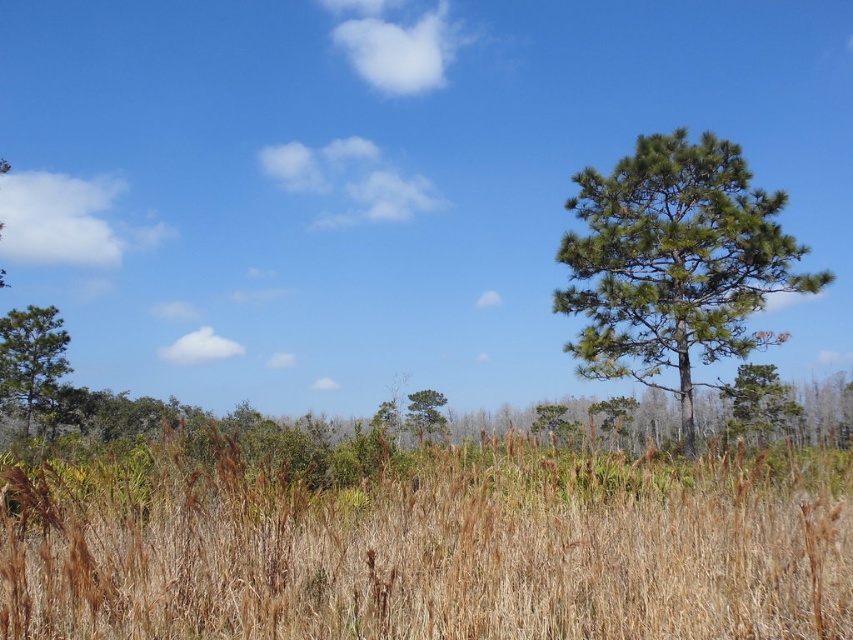
Question: Is green needle-like tree at right thinner than green textured pine tree at left?

Choices:
 (A) no
 (B) yes

Answer: (A)

Question: Which point is closer to the camera taking this photo?

Choices:
 (A) (410, 417)
 (B) (703, 356)
 (C) (44, 356)

Answer: (B)

Question: Can you confirm if green needle-like tree at right is positioned to the right of green matte tree at center?

Choices:
 (A) no
 (B) yes

Answer: (B)

Question: Which point is closer to the camera?

Choices:
 (A) green textured pine tree at left
 (B) green matte tree at center

Answer: (A)

Question: Can you confirm if green needle-like tree at right is bigger than green matte tree at center?

Choices:
 (A) no
 (B) yes

Answer: (B)

Question: Among these points, which one is farthest from the camera?

Choices:
 (A) (755, 426)
 (B) (434, 410)

Answer: (B)